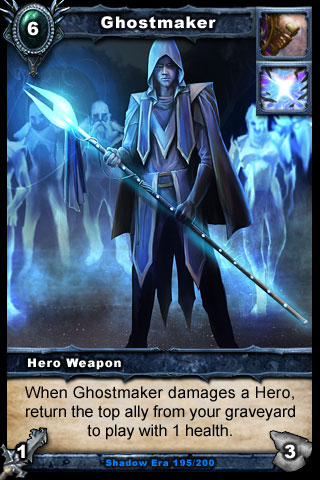
Identify the location of hood. The image size is (320, 480). (165, 50).